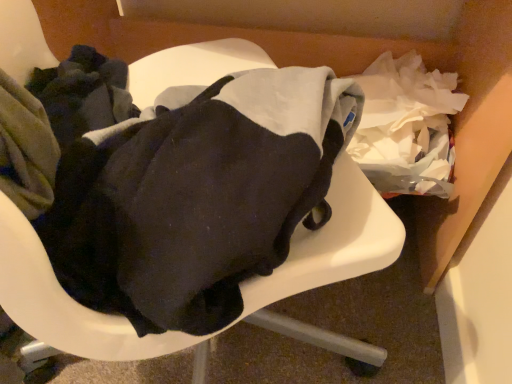
Question: Should I look upward or downward to see white cardboard box at center?

Choices:
 (A) up
 (B) down

Answer: (A)